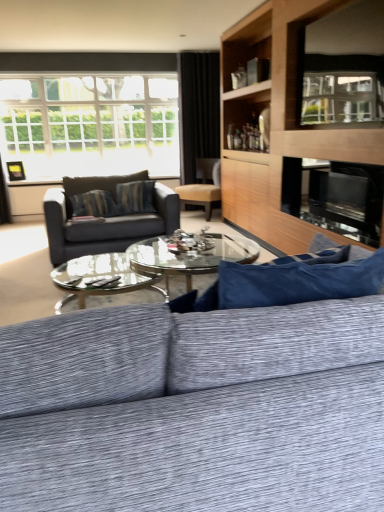
Question: Can you confirm if textured gray couch at center, the first studio couch viewed from the front, is taller than clear glass window screen at upper right?

Choices:
 (A) no
 (B) yes

Answer: (B)

Question: Is textured gray couch at center, the first studio couch viewed from the front, positioned behind clear glass window screen at upper right?

Choices:
 (A) yes
 (B) no

Answer: (B)

Question: From a real-world perspective, is textured gray couch at center, which ranks as the second studio couch in back-to-front order, physically above clear glass window screen at upper right?

Choices:
 (A) no
 (B) yes

Answer: (A)

Question: Is textured gray couch at center, which ranks as the second studio couch in back-to-front order, surrounding clear glass window screen at upper right?

Choices:
 (A) no
 (B) yes

Answer: (A)

Question: Is textured gray couch at center, the first studio couch viewed from the front, wider than clear glass window screen at upper right?

Choices:
 (A) no
 (B) yes

Answer: (B)

Question: Can you confirm if textured gray couch at center, which ranks as the second studio couch in back-to-front order, is positioned to the left of clear glass window screen at upper right?

Choices:
 (A) yes
 (B) no

Answer: (A)

Question: From a real-world perspective, is white glass window at upper left positioned over matte brown chair at center based on gravity?

Choices:
 (A) yes
 (B) no

Answer: (A)

Question: Can you see white glass window at upper left touching matte brown chair at center?

Choices:
 (A) no
 (B) yes

Answer: (A)

Question: Is white glass window at upper left to the left of matte brown chair at center from the viewer's perspective?

Choices:
 (A) yes
 (B) no

Answer: (A)

Question: Can you confirm if white glass window at upper left is shorter than matte brown chair at center?

Choices:
 (A) yes
 (B) no

Answer: (B)

Question: Considering the relative positions of white glass window at upper left and matte brown chair at center in the image provided, is white glass window at upper left behind matte brown chair at center?

Choices:
 (A) yes
 (B) no

Answer: (A)

Question: Is white glass window at upper left bigger than matte brown chair at center?

Choices:
 (A) yes
 (B) no

Answer: (A)

Question: From the image's perspective, is matte black couch at center, arranged as the 2th studio couch when viewed from the front, above white glass window at upper left?

Choices:
 (A) yes
 (B) no

Answer: (B)